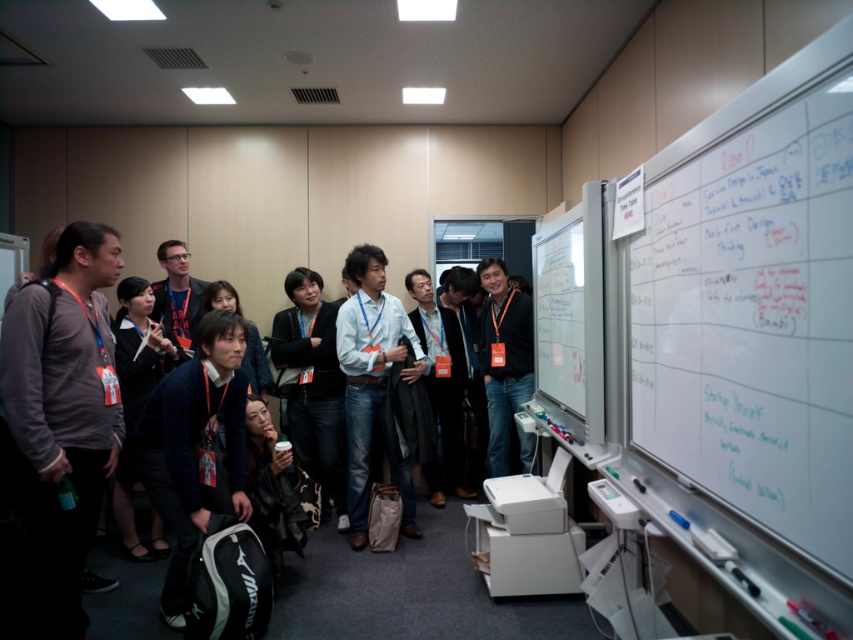
You are organizing a coat check area for an event and need to determine which of the two items, the dark gray sweater at center or the black matte jacket at center, requires more space to hang. Based on the description, which item would need more space?

The black matte jacket at center requires more space to hang because it is larger than the dark gray sweater at center.